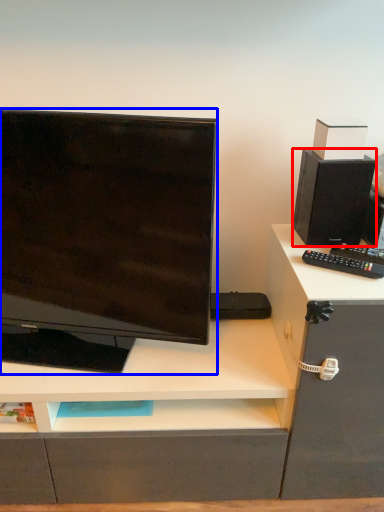
Question: Among these objects, which one is farthest to the camera, speaker (highlighted by a red box) or computer monitor (highlighted by a blue box)?

Choices:
 (A) speaker
 (B) computer monitor

Answer: (A)